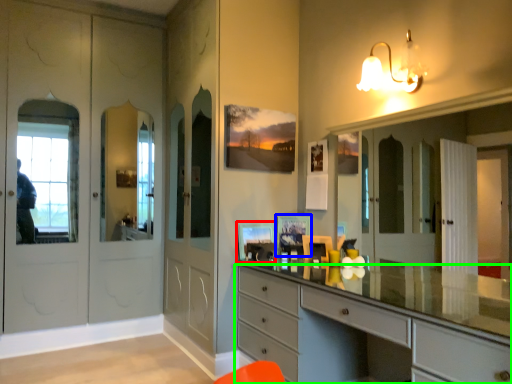
Question: Which is farther away from picture frame (highlighted by a red box)? picture frame (highlighted by a blue box) or chest of drawers (highlighted by a green box)?

Choices:
 (A) picture frame
 (B) chest of drawers

Answer: (B)